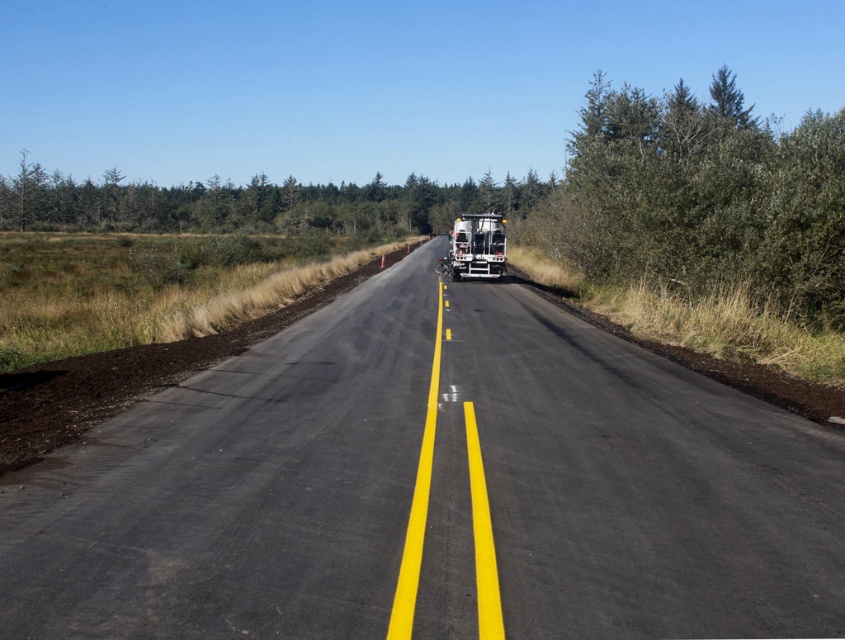
Between black asphalt road at center and green leafy trees at upper center, which one has less height?

black asphalt road at center

In the scene shown: Is black asphalt road at center above green leafy trees at upper center?

No.

Who is more distant from viewer, [429,364] or [134,195]?

The point [134,195] is more distant.

Image resolution: width=845 pixels, height=640 pixels. Identify the location of black asphalt road at center. (431, 490).

Which is in front, point (576, 499) or point (464, 268)?

Point (576, 499)

Can you confirm if black asphalt road at center is smaller than metallic silver trailer truck at center?

Yes.

Who is more forward, (391,416) or (488,221)?

Point (391,416) is in front.

Find the location of a particular element. The height and width of the screenshot is (640, 845). black asphalt road at center is located at coordinates (431, 490).

Does green leafy shrub at right have a greater width compared to green leafy trees at upper center?

In fact, green leafy shrub at right might be narrower than green leafy trees at upper center.

Who is shorter, green leafy shrub at right or green leafy trees at upper center?

green leafy trees at upper center

The width and height of the screenshot is (845, 640). What do you see at coordinates (704, 196) in the screenshot? I see `green leafy shrub at right` at bounding box center [704, 196].

Locate an element on the screen. green leafy shrub at right is located at coordinates (704, 196).